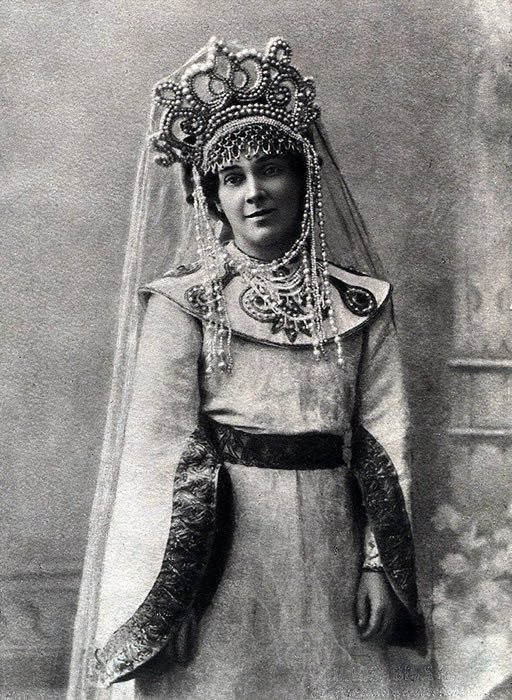
Identify the location of wall. (54, 481).